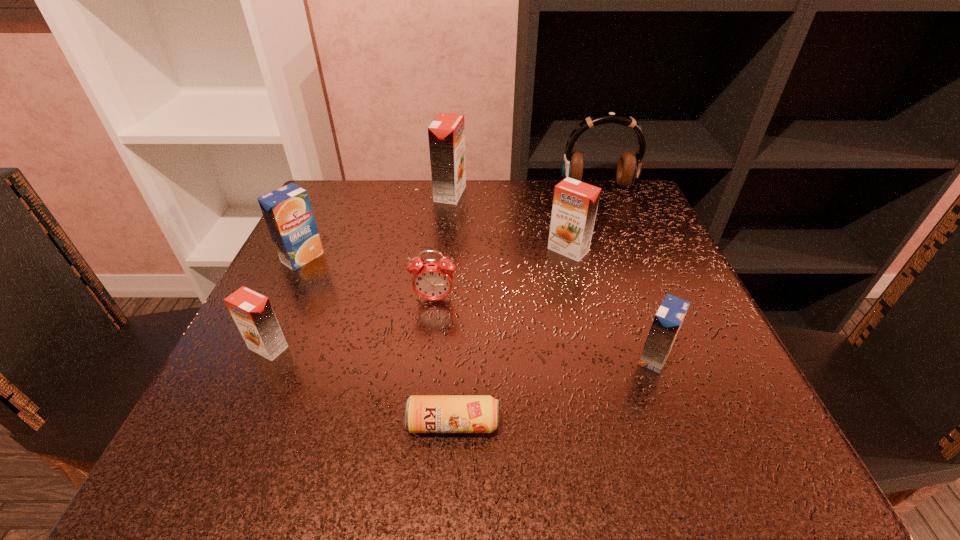
In the image, there is a desktop. Where is `free space at the near edge`? Image resolution: width=960 pixels, height=540 pixels. free space at the near edge is located at coordinates (390, 469).

This screenshot has height=540, width=960. Find the location of `vacant region at the left edge of the desktop`. vacant region at the left edge of the desktop is located at coordinates (338, 337).

You are a GUI agent. You are given a task and a screenshot of the screen. Output one action in this format:
    pyautogui.click(x=<x>, y=<y>)
    Task: Click on the vacant area at the right edge
    The image size is (960, 540).
    Given the screenshot: What is the action you would take?
    pyautogui.click(x=626, y=315)

In the image, there is a desktop. Where is `vacant space at the near left corner`? vacant space at the near left corner is located at coordinates (308, 421).

You are a GUI agent. You are given a task and a screenshot of the screen. Output one action in this format:
    pyautogui.click(x=<x>, y=<y>)
    Task: Click on the free space at the far right corner of the desktop
    The image size is (960, 540).
    Given the screenshot: What is the action you would take?
    pyautogui.click(x=626, y=224)

Identify the location of vacant area between the beer can and the right blue orange_juice. The image size is (960, 540). (554, 391).

I want to click on blank region between the second biggest orange orange juice and the nearest object, so click(x=511, y=337).

I want to click on free spot between the second orange juice from right to left and the right blue orange_juice, so click(612, 304).

Find the location of a particular element. This screenshot has width=960, height=540. free space between the second biggest orange orange juice and the farthest orange juice is located at coordinates (509, 222).

Where is `free point between the nearest object and the left blue orange_juice`? This screenshot has width=960, height=540. free point between the nearest object and the left blue orange_juice is located at coordinates (378, 341).